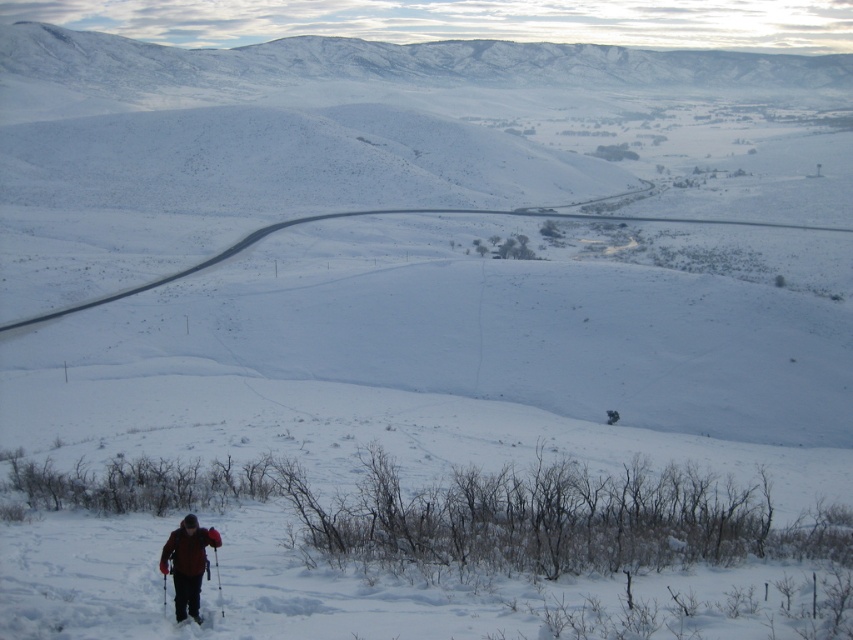
Question: Which of the following is the closest to the observer?

Choices:
 (A) black matte ski at lower left
 (B) red fleece jacket at lower left

Answer: (A)

Question: Can you confirm if red fleece jacket at lower left is bigger than black matte ski at lower left?

Choices:
 (A) yes
 (B) no

Answer: (A)

Question: Can you confirm if red fleece jacket at lower left is smaller than black matte ski at lower left?

Choices:
 (A) yes
 (B) no

Answer: (B)

Question: Does red fleece jacket at lower left appear over black matte ski at lower left?

Choices:
 (A) no
 (B) yes

Answer: (A)